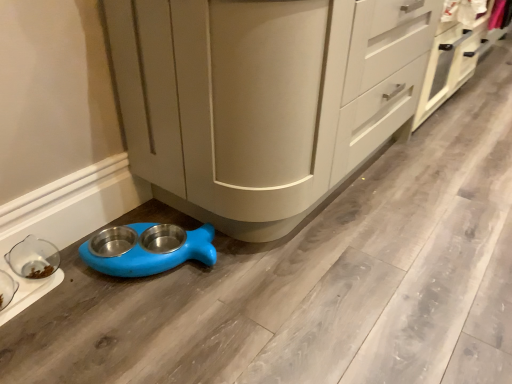
The image size is (512, 384). Find the location of `free space in front of blue plastic pet feeder at lower left, the 1th appliance positioned from the right`. free space in front of blue plastic pet feeder at lower left, the 1th appliance positioned from the right is located at coordinates (129, 320).